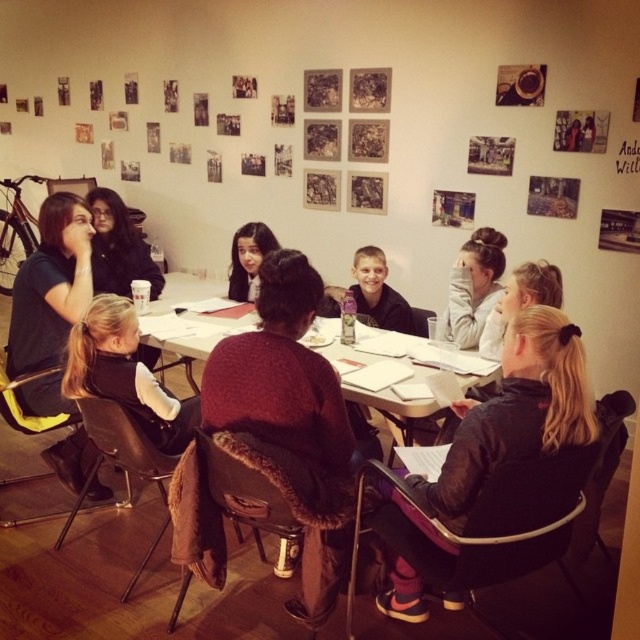
You are organizing a coat rack for the group. The space available is just enough for items the size of the matte black hair at center. Can the black fleece jacket at lower right fit in this space?

The black fleece jacket at lower right is bigger than the matte black hair at center, so it cannot fit in the space allocated for items of the matte black hair at center size.

You are organizing a small event and need to place a decorative item on the table. The white paper at center is already there. Where should you place the decorative item so it doesn not block the black fleece jacket at lower right?

You should place the decorative item above the white paper at center since the black fleece jacket at lower right is below it and placing the item above won block the jacket.